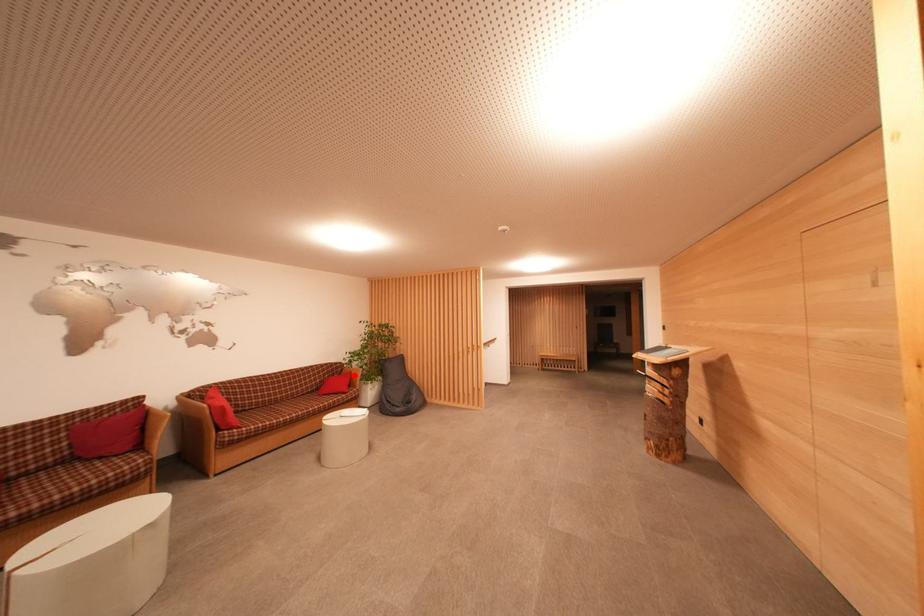
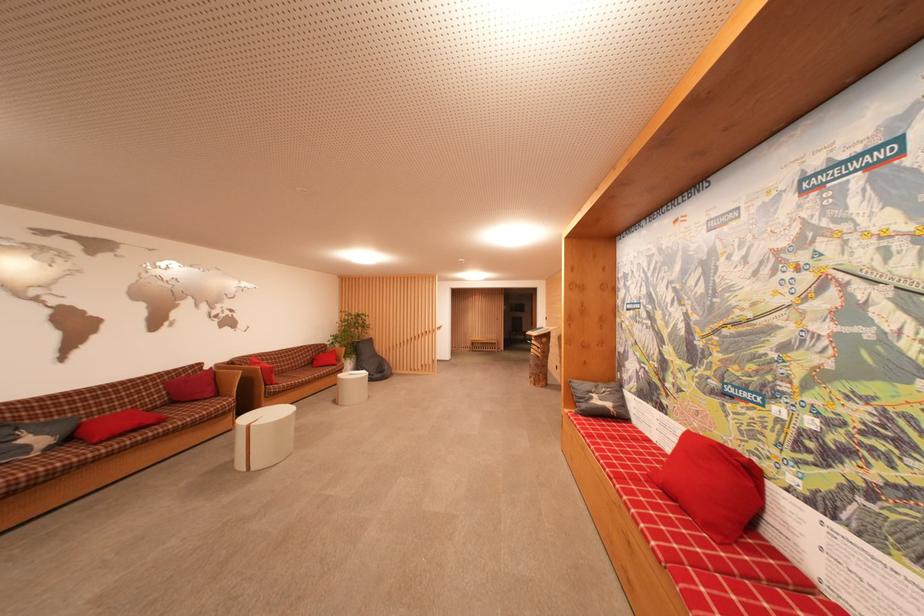
The point at the highlighted location is marked in the first image. Where is the corresponding point in the second image?

(338, 354)